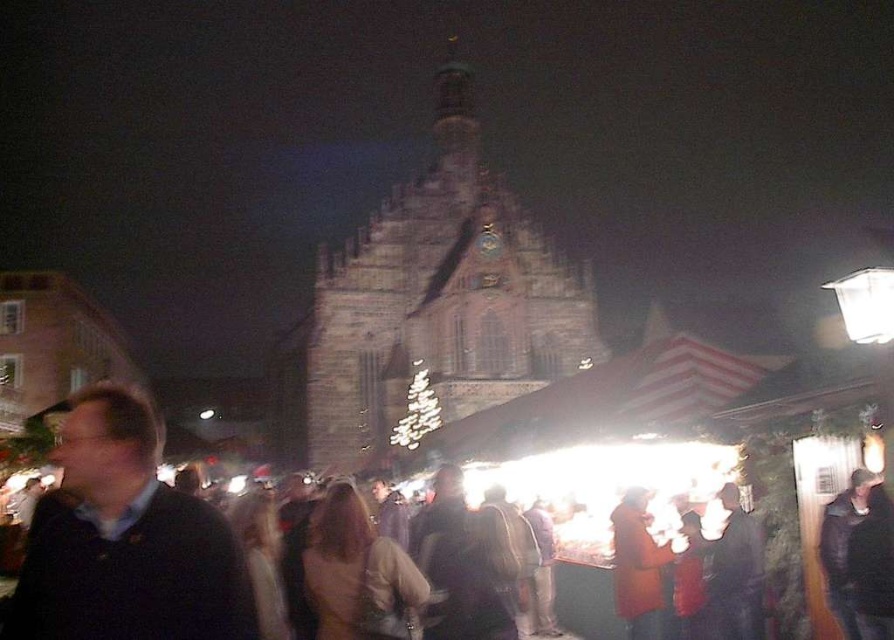
Can you confirm if dark stone church at center is wider than dark brown leather jacket at lower right?

Yes, dark stone church at center is wider than dark brown leather jacket at lower right.

Is point (549, 346) in front of point (837, 504)?

No.

The image size is (894, 640). Find the location of `dark stone church at center`. dark stone church at center is located at coordinates (428, 305).

Does point (310, 392) lie behind point (106, 404)?

Yes, it is.

Is dark stone church at center bigger than dark blue sweater at left?

Indeed, dark stone church at center has a larger size compared to dark blue sweater at left.

Identify the location of dark stone church at center. click(x=428, y=305).

Is dark blue sweater at left taller than dark brown leather jacket at lower right?

Yes.

Is point (148, 458) closer to viewer compared to point (865, 502)?

Yes.

This screenshot has width=894, height=640. Find the location of `dark blue sweater at left`. dark blue sweater at left is located at coordinates (125, 540).